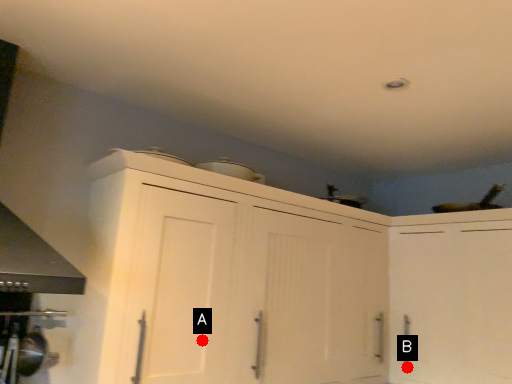
Question: Two points are circled on the image, labeled by A and B beside each circle. Which point is further to the camera?

Choices:
 (A) A is further
 (B) B is further

Answer: (B)